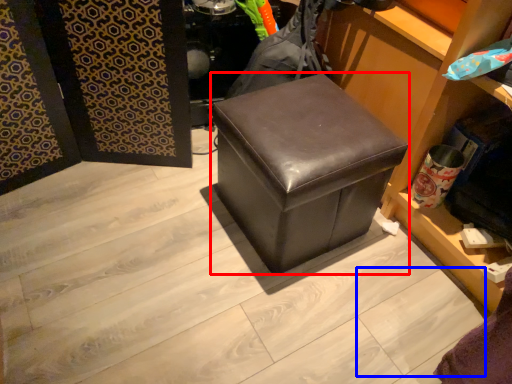
Question: Which object is further to the camera taking this photo, furniture (highlighted by a red box) or square (highlighted by a blue box)?

Choices:
 (A) furniture
 (B) square

Answer: (A)